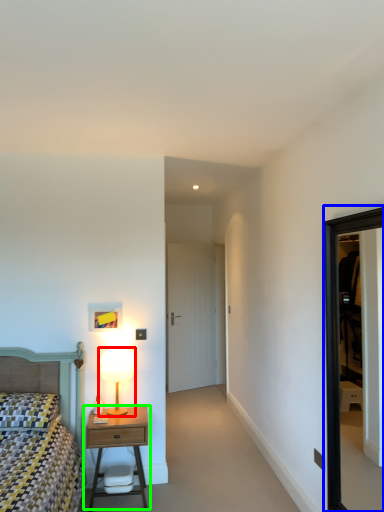
Question: Which object is the farthest from table lamp (highlighted by a red box)? Choose among these: window (highlighted by a blue box) or nightstand (highlighted by a green box).

Choices:
 (A) window
 (B) nightstand

Answer: (A)